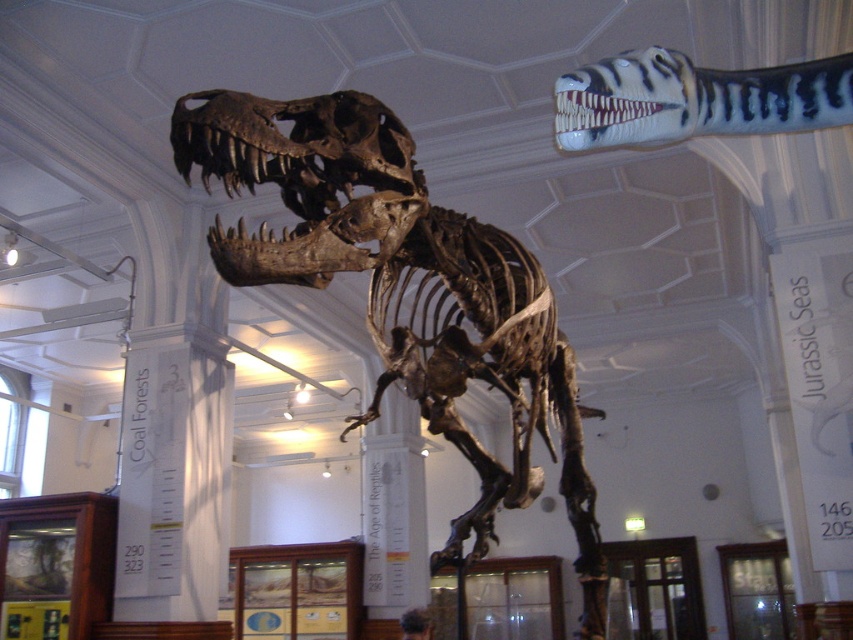
Question: Does brown bone skeleton at center have a lesser width compared to shiny blue and white striped skull at upper right?

Choices:
 (A) no
 (B) yes

Answer: (A)

Question: Which point is farther to the camera?

Choices:
 (A) shiny blue and white striped skull at upper right
 (B) brown bone skeleton at center

Answer: (B)

Question: Is brown bone skeleton at center smaller than shiny blue and white striped skull at upper right?

Choices:
 (A) yes
 (B) no

Answer: (B)

Question: Which point is farther to the camera?

Choices:
 (A) (519, 436)
 (B) (624, 131)

Answer: (A)

Question: Does brown bone skeleton at center appear over shiny blue and white striped skull at upper right?

Choices:
 (A) yes
 (B) no

Answer: (B)

Question: Which of the following is the farthest from the observer?

Choices:
 (A) tap(341, 182)
 (B) tap(763, 109)

Answer: (A)